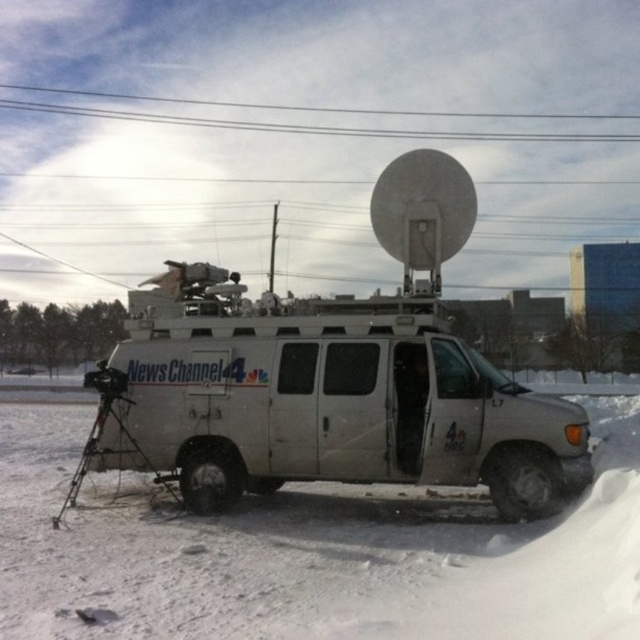
In the scene shown: Does white powdery snow at lower left have a lesser width compared to white metallic van at center?

In fact, white powdery snow at lower left might be wider than white metallic van at center.

Is white powdery snow at lower left further to the viewer compared to white metallic van at center?

No, it is in front of white metallic van at center.

Between point (419, 497) and point (337, 477), which one is positioned in front?

Point (337, 477) is in front.

The width and height of the screenshot is (640, 640). I want to click on white powdery snow at lower left, so click(312, 552).

Measure the distance from black wire at upper center to black matte tripod at lower left.

black wire at upper center and black matte tripod at lower left are 41.81 meters apart from each other.

Does black wire at upper center have a smaller size compared to black matte tripod at lower left?

No, black wire at upper center is not smaller than black matte tripod at lower left.

Is point (321, 132) positioned before point (65, 513)?

No, (321, 132) is further to viewer.

The height and width of the screenshot is (640, 640). What are the coordinates of `black wire at upper center` in the screenshot? It's located at (310, 125).

Is white metallic van at center closer to the viewer compared to black matte tripod at lower left?

No, it is not.

Identify the location of white metallic van at center. Image resolution: width=640 pixels, height=640 pixels. (324, 401).

The image size is (640, 640). I want to click on white metallic van at center, so click(324, 401).